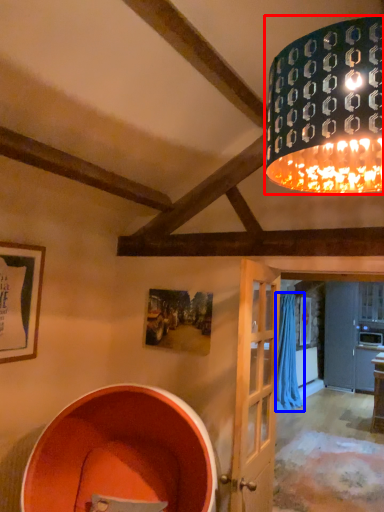
Question: Which object appears closest to the camera in this image, lamp (highlighted by a red box) or curtain (highlighted by a blue box)?

Choices:
 (A) lamp
 (B) curtain

Answer: (A)